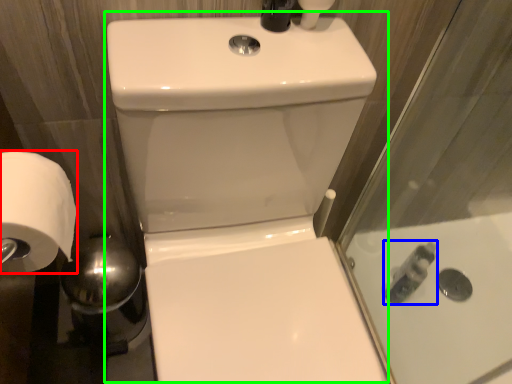
Question: Estimate the real-world distances between objects in this image. Which object is farther from toilet paper (highlighted by a red box), toiletry (highlighted by a blue box) or sink (highlighted by a green box)?

Choices:
 (A) toiletry
 (B) sink

Answer: (A)